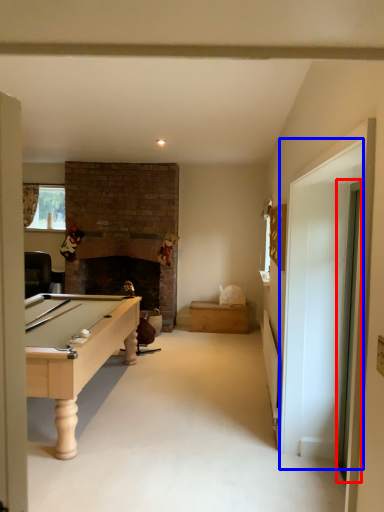
Question: Among these objects, which one is nearest to the camera, glass door (highlighted by a red box) or glass door (highlighted by a blue box)?

Choices:
 (A) glass door
 (B) glass door

Answer: (B)